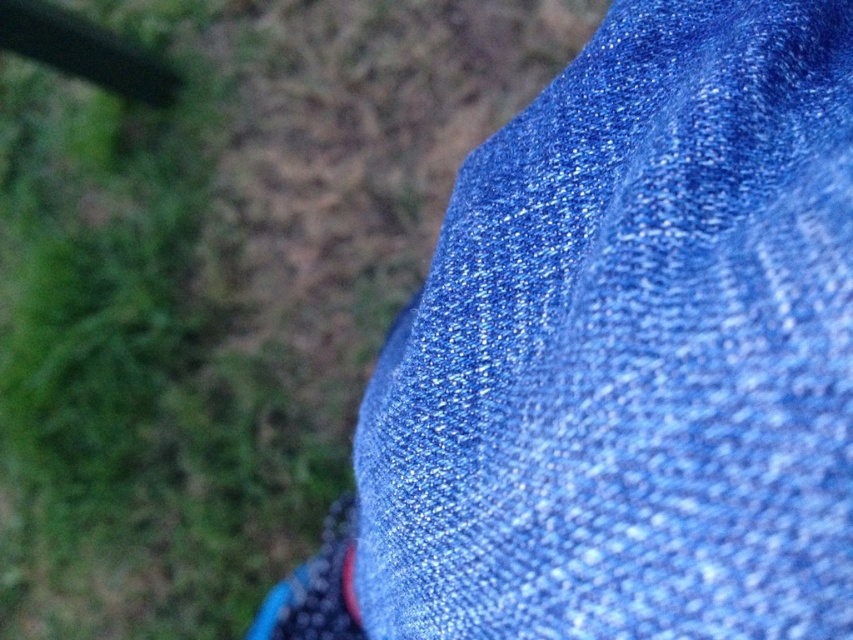
You are a fashion designer examining a closeup of fabrics. You see the blue textured fabric at upper right and the blue glittery fabric at upper right. Which fabric is located to the right of the other?

The blue textured fabric at upper right is positioned on the right side of the blue glittery fabric at upper right.

Based on the photo, you are a fashion designer trying to place a golden button on the blue textured fabric at upper right. The button must be placed exactly at the center of the fabric. Given the fabric is located at point 0.548, 0.742, where should you place the button?

The golden button should be placed at the center of the blue textured fabric at upper right, which is located at point (631,349).

You are an assistant organizing a fashion show. You need to arrange two blue fabrics for a display. The blue textured fabric at upper right and the blue glittery fabric at upper right. Based on their positions in the image, which one is placed lower?

The blue textured fabric at upper right is located below the blue glittery fabric at upper right, so the blue textured fabric at upper right is placed lower.